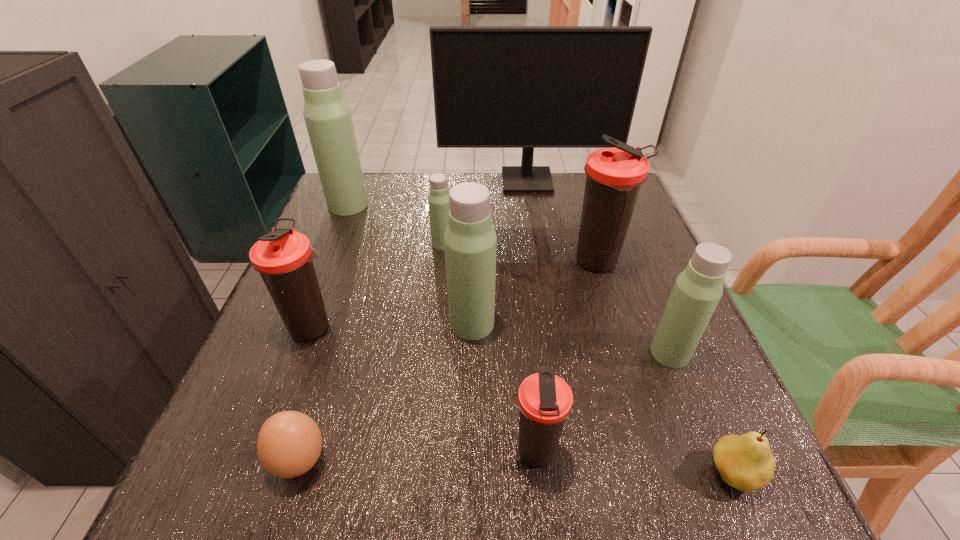
You are a GUI agent. You are given a task and a screenshot of the screen. Output one action in this format:
    pyautogui.click(x=<x>, y=<y>)
    Task: Click on the second farthest light thermos bottle
    This screenshot has width=960, height=540.
    Given the screenshot: What is the action you would take?
    pyautogui.click(x=438, y=200)

Where is `the third thermos bottle from left to right`? The image size is (960, 540). the third thermos bottle from left to right is located at coordinates (438, 200).

The width and height of the screenshot is (960, 540). Identify the location of the fifth thermos bottle from left to right. (545, 400).

You are a GUI agent. You are given a task and a screenshot of the screen. Output one action in this format:
    pyautogui.click(x=<x>, y=<y>)
    Task: Click on the smallest brown thermos bottle
    The image size is (960, 540).
    Given the screenshot: What is the action you would take?
    pyautogui.click(x=545, y=400)

You are a GUI agent. You are given a task and a screenshot of the screen. Output one action in this format:
    pyautogui.click(x=<x>, y=<y>)
    Task: Click on the pear
    The height and width of the screenshot is (540, 960).
    Given the screenshot: What is the action you would take?
    pyautogui.click(x=745, y=462)

Identify the location of boiled egg. (289, 443).

Find the location of a particular element. The image size is (960, 540). vacant region located 0.080m on the front-facing side of the farthest object is located at coordinates (531, 209).

Identify the location of vacant space located 0.320m on the right of the leftmost light thermos bottle. (487, 205).

At what (x,y) coordinates should I click in order to perform the action: click on vacant region located on the back of the rightmost brown thermos bottle. Please return your answer as a coordinate pair (x, y). The height and width of the screenshot is (540, 960). Looking at the image, I should click on (582, 207).

This screenshot has width=960, height=540. Identify the location of vacant space located 0.070m on the back of the second light thermos bottle from right to left. (472, 285).